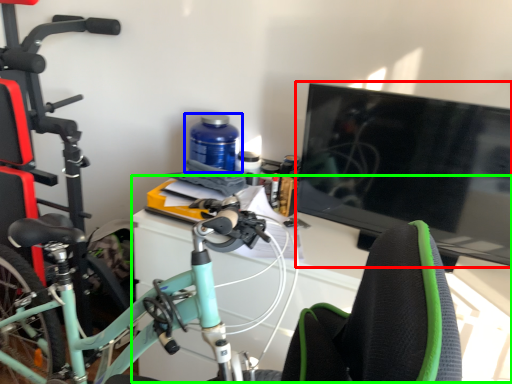
Question: Estimate the real-world distances between objects in this image. Which object is closer to television (highlighted by a red box), bottle (highlighted by a blue box) or computer desk (highlighted by a green box)?

Choices:
 (A) bottle
 (B) computer desk

Answer: (B)